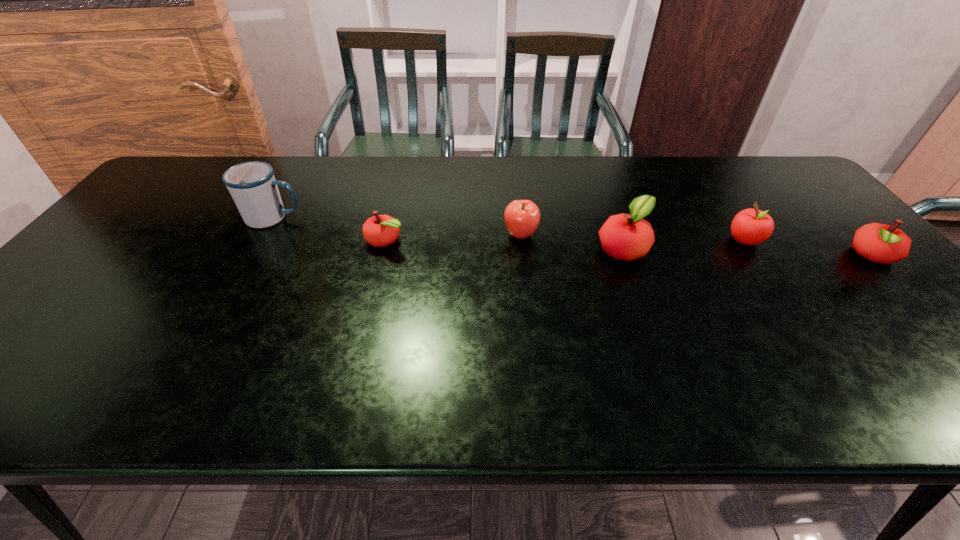
Identify the location of the leftmost apple. (380, 230).

You are a GUI agent. You are given a task and a screenshot of the screen. Output one action in this format:
    pyautogui.click(x=<x>, y=<y>)
    Task: Click on the shortest object
    The height and width of the screenshot is (540, 960).
    Given the screenshot: What is the action you would take?
    pyautogui.click(x=380, y=230)

This screenshot has width=960, height=540. I want to click on the third apple from right to left, so click(x=628, y=237).

Identify the location of the rightmost apple. (881, 243).

Where is `the rightmost object`? This screenshot has width=960, height=540. the rightmost object is located at coordinates (881, 243).

Locate an element on the screen. Image resolution: width=960 pixels, height=540 pixels. the fifth object from left to right is located at coordinates (750, 226).

The image size is (960, 540). Identify the location of the second apple from left to right. (521, 217).

At what (x,y) coordinates should I click in order to perform the action: click on the leftmost object. Please return your answer as a coordinate pair (x, y). Looking at the image, I should click on (x=252, y=185).

Where is `the tallest object`? This screenshot has height=540, width=960. the tallest object is located at coordinates (252, 185).

Identify the location of vacant region located 0.140m on the front of the shortest object. (372, 291).